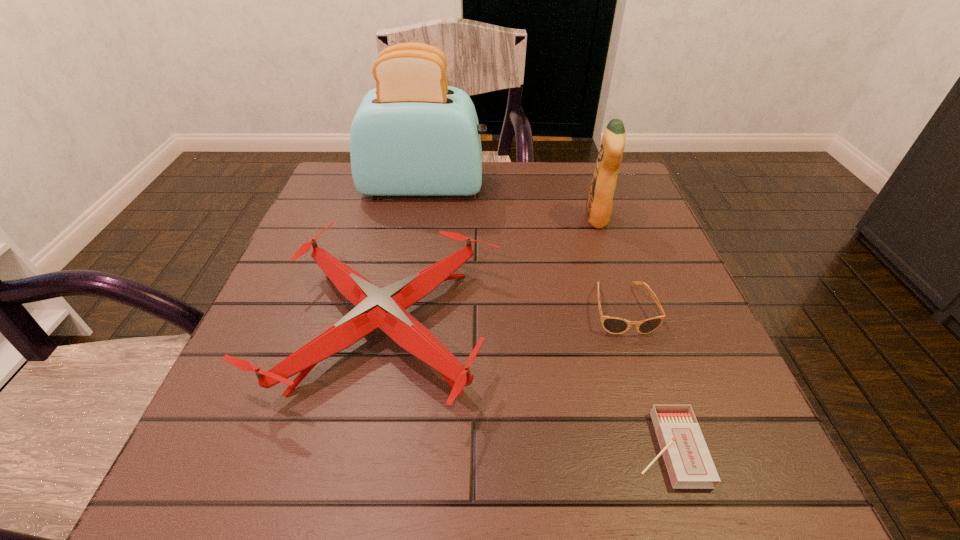
Identify the location of vacant area that lies between the tallest object and the matchbox. (545, 318).

The width and height of the screenshot is (960, 540). I want to click on vacant space that's between the matchbox and the toaster, so click(545, 318).

This screenshot has width=960, height=540. Identify the location of free space between the sunglasses and the detergent. (610, 264).

This screenshot has width=960, height=540. Find the location of `object that is the closest one to the tallest object`. object that is the closest one to the tallest object is located at coordinates (385, 308).

Choose which object is the third nearest neighbor to the fourth tallest object. Please provide its 2D coordinates. Your answer should be formatted as a tuple, i.e. [(x, y)], where the tuple contains the x and y coordinates of a point satisfying the conditions above.

[(599, 202)]

Identify the location of free location that satisfies the following two spatial constraints: 1. on the label of the detergent; 2. on the front side of the drone. (633, 327).

This screenshot has height=540, width=960. Find the location of `vacant space that satisfies the following two spatial constraints: 1. on the label of the second farthest object; 2. on the front-facing side of the second shortest object`. vacant space that satisfies the following two spatial constraints: 1. on the label of the second farthest object; 2. on the front-facing side of the second shortest object is located at coordinates (627, 309).